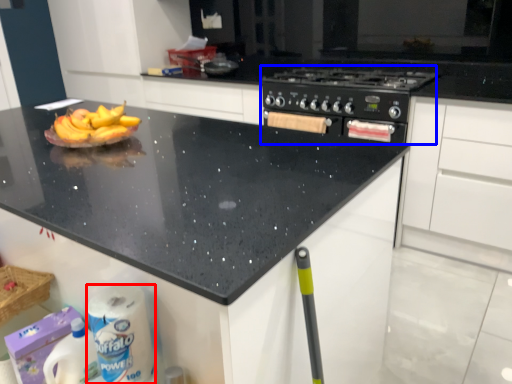
Question: Among these objects, which one is nearest to the camera, toilet paper (highlighted by a red box) or appliance (highlighted by a blue box)?

Choices:
 (A) toilet paper
 (B) appliance

Answer: (A)